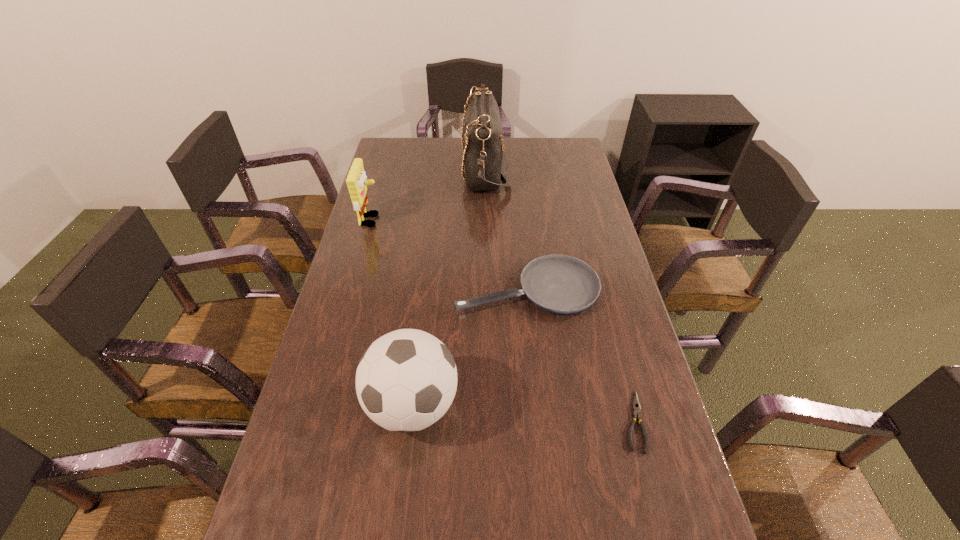
Where is `empty location between the sponge and the soccer ball`? empty location between the sponge and the soccer ball is located at coordinates (392, 313).

Identify the location of vacant space that's between the second shortest object and the tallest object. Image resolution: width=960 pixels, height=540 pixels. (506, 228).

At what (x,y) coordinates should I click in order to perform the action: click on free space between the leftmost object and the soccer ball. Please return your answer as a coordinate pair (x, y). The height and width of the screenshot is (540, 960). Looking at the image, I should click on (392, 313).

Find the location of a particular element. The width and height of the screenshot is (960, 540). free space between the farthest object and the fourth tallest object is located at coordinates (506, 228).

The width and height of the screenshot is (960, 540). In order to click on the third closest object to the pliers in this screenshot , I will do `click(485, 160)`.

Locate an element on the screen. the second closest object to the soccer ball is located at coordinates (636, 406).

Locate an element on the screen. The image size is (960, 540). vacant region that satisfies the following two spatial constraints: 1. on the back side of the third nearest object; 2. at the front of the handbag with chain and zipper is located at coordinates (515, 168).

Where is `vacant area in the image that satisfies the following two spatial constraints: 1. on the face of the leftmost object; 2. on the back side of the soccer ball`? This screenshot has width=960, height=540. vacant area in the image that satisfies the following two spatial constraints: 1. on the face of the leftmost object; 2. on the back side of the soccer ball is located at coordinates (320, 405).

What are the coordinates of `vacant space that satisfies the following two spatial constraints: 1. at the front of the handbag with chain and zipper; 2. on the left side of the third farthest object` in the screenshot? It's located at (487, 288).

Where is `vacant region that satisfies the following two spatial constraints: 1. on the face of the third nearest object; 2. on the right side of the leftmost object`? The height and width of the screenshot is (540, 960). vacant region that satisfies the following two spatial constraints: 1. on the face of the third nearest object; 2. on the right side of the leftmost object is located at coordinates (352, 288).